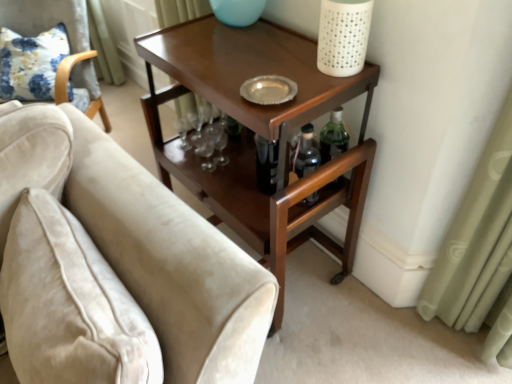
The height and width of the screenshot is (384, 512). Find the location of `velvet beige armchair at left`. velvet beige armchair at left is located at coordinates (69, 41).

Which is in front, point (37, 83) or point (54, 5)?

The point (37, 83) is more forward.

Is floral fabric pillow at upper left far away from velvet beige armchair at left?

floral fabric pillow at upper left is actually quite close to velvet beige armchair at left.

Is floral fabric pillow at upper left facing away from velvet beige armchair at left?

Absolutely, floral fabric pillow at upper left is directed away from velvet beige armchair at left.

Which is correct: shiny brown wood side table at center is inside velvet beige armchair at left, or outside of it?

shiny brown wood side table at center lies outside velvet beige armchair at left.

Is shiny brown wood side table at center next to velvet beige armchair at left and touching it?

No, shiny brown wood side table at center is not in contact with velvet beige armchair at left.

Can you confirm if shiny brown wood side table at center is taller than velvet beige armchair at left?

No, shiny brown wood side table at center is not taller than velvet beige armchair at left.

From the image's perspective, which one is positioned lower, floral fabric pillow at upper left or velvet beige couch at lower left?

velvet beige couch at lower left.

Is floral fabric pillow at upper left not close to velvet beige couch at lower left?

That's right, there is a large distance between floral fabric pillow at upper left and velvet beige couch at lower left.

Visually, is floral fabric pillow at upper left positioned to the left or to the right of velvet beige couch at lower left?

Based on their positions, floral fabric pillow at upper left is located to the left of velvet beige couch at lower left.

Is velvet beige couch at lower left with shiny brown wood side table at center?

No, velvet beige couch at lower left is not with shiny brown wood side table at center.

This screenshot has height=384, width=512. I want to click on table directly beneath the velvet beige couch at lower left (from a real-world perspective), so click(x=260, y=133).

Between velvet beige couch at lower left and shiny brown wood side table at center, which one appears on the right side from the viewer's perspective?

shiny brown wood side table at center.

Is velvet beige couch at lower left aimed at floral fabric pillow at upper left?

No, velvet beige couch at lower left is not oriented towards floral fabric pillow at upper left.

In the scene shown: Considering the sizes of objects velvet beige couch at lower left and floral fabric pillow at upper left in the image provided, who is smaller, velvet beige couch at lower left or floral fabric pillow at upper left?

floral fabric pillow at upper left is smaller.

Does velvet beige couch at lower left appear on the right side of floral fabric pillow at upper left?

Yes.

Does velvet beige couch at lower left have a greater height compared to floral fabric pillow at upper left?

Correct, velvet beige couch at lower left is much taller as floral fabric pillow at upper left.

Is shiny brown wood side table at center in front of or behind velvet beige couch at lower left in the image?

In the image, shiny brown wood side table at center appears behind velvet beige couch at lower left.

Between shiny brown wood side table at center and velvet beige couch at lower left, which one appears on the left side from the viewer's perspective?

From the viewer's perspective, velvet beige couch at lower left appears more on the left side.

Consider the image. Is floral fabric pillow at upper left far away from shiny brown wood side table at center?

floral fabric pillow at upper left is far away from shiny brown wood side table at center.

Which object is closer to the camera, floral fabric pillow at upper left or shiny brown wood side table at center?

shiny brown wood side table at center.

Does floral fabric pillow at upper left have a lesser width compared to shiny brown wood side table at center?

Yes, floral fabric pillow at upper left is thinner than shiny brown wood side table at center.

Which object is positioned more to the left, floral fabric pillow at upper left or shiny brown wood side table at center?

floral fabric pillow at upper left is more to the left.

Locate an element on the screen. chair located on the left of floral fabric pillow at upper left is located at coordinates (69, 41).

The width and height of the screenshot is (512, 384). I want to click on table lying in front of the velvet beige armchair at left, so click(260, 133).

From the image, which object appears to be farther from shiny brown wood side table at center, velvet beige armchair at left or floral fabric pillow at upper left?

Among the two, floral fabric pillow at upper left is located further to shiny brown wood side table at center.

Looking at the image, which one is located further to floral fabric pillow at upper left, velvet beige couch at lower left or shiny brown wood side table at center?

Among the two, velvet beige couch at lower left is located further to floral fabric pillow at upper left.

Looking at this image, when comparing their distances from velvet beige armchair at left, does velvet beige couch at lower left or shiny brown wood side table at center seem further?

velvet beige couch at lower left.

Considering their positions, is shiny brown wood side table at center positioned closer to floral fabric pillow at upper left than velvet beige couch at lower left?

shiny brown wood side table at center lies closer to floral fabric pillow at upper left than the other object.

Looking at the image, which one is located closer to shiny brown wood side table at center, floral fabric pillow at upper left or velvet beige couch at lower left?

Based on the image, velvet beige couch at lower left appears to be nearer to shiny brown wood side table at center.

Considering their positions, is floral fabric pillow at upper left positioned further to velvet beige armchair at left than shiny brown wood side table at center?

shiny brown wood side table at center lies further to velvet beige armchair at left than the other object.

Consider the image. Considering their positions, is velvet beige couch at lower left positioned further to shiny brown wood side table at center than velvet beige armchair at left?

velvet beige armchair at left.

Estimate the real-world distances between objects in this image. Which object is further from velvet beige couch at lower left, shiny brown wood side table at center or velvet beige armchair at left?

The object further to velvet beige couch at lower left is velvet beige armchair at left.

What are the coordinates of `pillow between velvet beige armchair at left and shiny brown wood side table at center` in the screenshot? It's located at (31, 63).

The width and height of the screenshot is (512, 384). In order to click on studio couch between velvet beige armchair at left and shiny brown wood side table at center from left to right in this screenshot , I will do `click(115, 266)`.

Locate an element on the screen. The height and width of the screenshot is (384, 512). chair between velvet beige couch at lower left and floral fabric pillow at upper left in the front-back direction is located at coordinates [69, 41].

Locate an element on the screen. table positioned between velvet beige couch at lower left and floral fabric pillow at upper left from near to far is located at coordinates (260, 133).